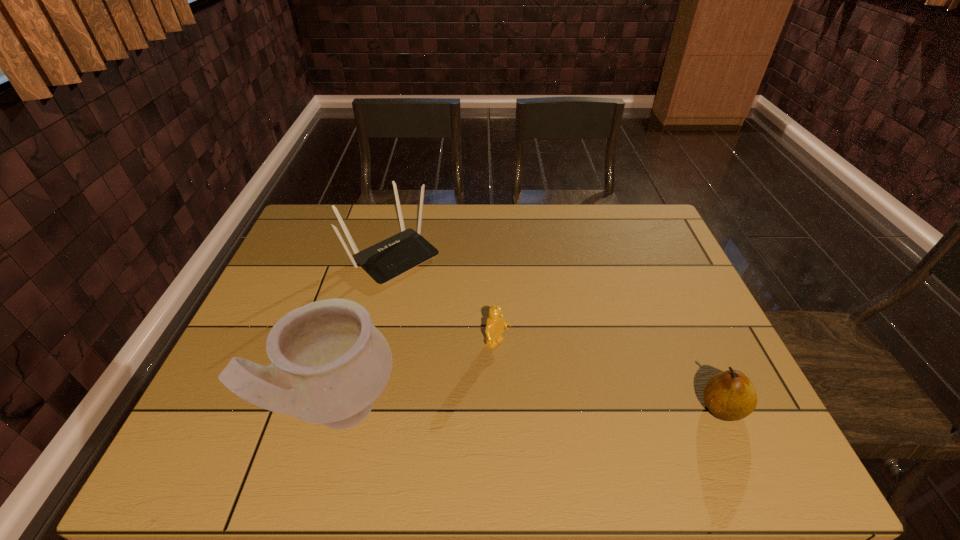
This screenshot has height=540, width=960. I want to click on free point between the rightmost object and the pottery, so click(531, 409).

Find the location of `blank region between the third nearest object and the router`. blank region between the third nearest object and the router is located at coordinates (444, 300).

Find the location of a particular element. The width and height of the screenshot is (960, 540). free point between the farthest object and the rightmost object is located at coordinates (557, 332).

Locate an element on the screen. empty space between the router and the rightmost object is located at coordinates (557, 332).

Identify which object is the third nearest to the pear. Please provide its 2D coordinates. Your answer should be formatted as a tuple, i.e. [(x, y)], where the tuple contains the x and y coordinates of a point satisfying the conditions above.

[(392, 257)]

You are a GUI agent. You are given a task and a screenshot of the screen. Output one action in this format:
    pyautogui.click(x=<x>, y=<y>)
    Task: Click on the object that is the third closest to the second tallest object
    Image resolution: width=960 pixels, height=540 pixels.
    Given the screenshot: What is the action you would take?
    click(x=729, y=395)

This screenshot has height=540, width=960. Identify the location of vacant point that satisfies the following two spatial constraints: 1. on the front side of the second object from right to left; 2. on the right side of the farthest object. (371, 345).

Where is `free spot that satisfies the following two spatial constraints: 1. on the front side of the rightmost object; 2. on the right side of the third shortest object`? free spot that satisfies the following two spatial constraints: 1. on the front side of the rightmost object; 2. on the right side of the third shortest object is located at coordinates (355, 408).

Locate an element on the screen. The width and height of the screenshot is (960, 540). free location that satisfies the following two spatial constraints: 1. on the front side of the rightmost object; 2. on the left side of the farthest object is located at coordinates (355, 408).

Locate an element on the screen. The height and width of the screenshot is (540, 960). free space that satisfies the following two spatial constraints: 1. on the front side of the second tallest object; 2. on the right side of the rightmost object is located at coordinates (355, 408).